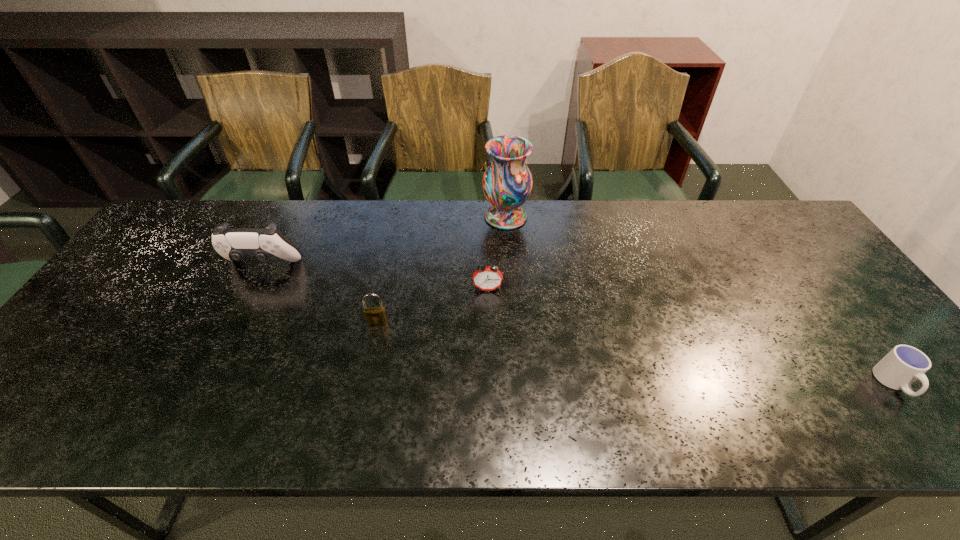
I want to click on empty space between the fourth nearest object and the second nearest object, so click(320, 294).

I want to click on free space between the fourth object from right to left and the second tallest object, so click(320, 294).

Where is `object that can be found as the second closest to the shortest object`? This screenshot has width=960, height=540. object that can be found as the second closest to the shortest object is located at coordinates (507, 182).

At what (x,y) coordinates should I click in order to perform the action: click on object identified as the fourth closest to the padlock. Please return your answer as a coordinate pair (x, y). Image resolution: width=960 pixels, height=540 pixels. Looking at the image, I should click on (904, 364).

Identify the location of vacant space that satisfies the following two spatial constraints: 1. on the front-facing side of the fourth farthest object; 2. on the left side of the control. This screenshot has width=960, height=540. (233, 322).